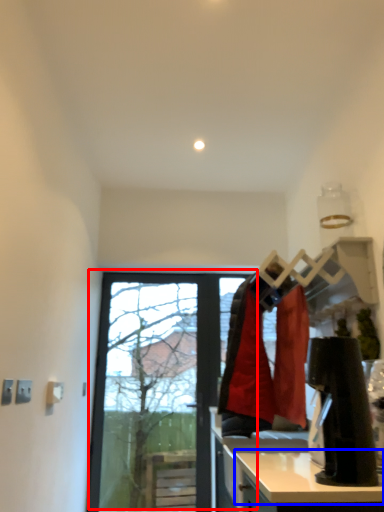
Question: Which object is further to the camera taking this photo, window (highlighted by a red box) or counter top (highlighted by a blue box)?

Choices:
 (A) window
 (B) counter top

Answer: (A)